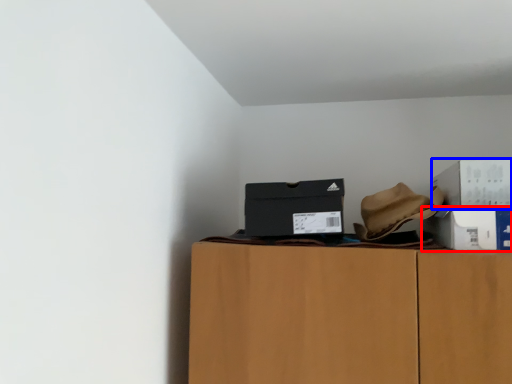
Question: Which point is closer to the camera, box (highlighted by a red box) or box (highlighted by a blue box)?

Choices:
 (A) box
 (B) box

Answer: (B)